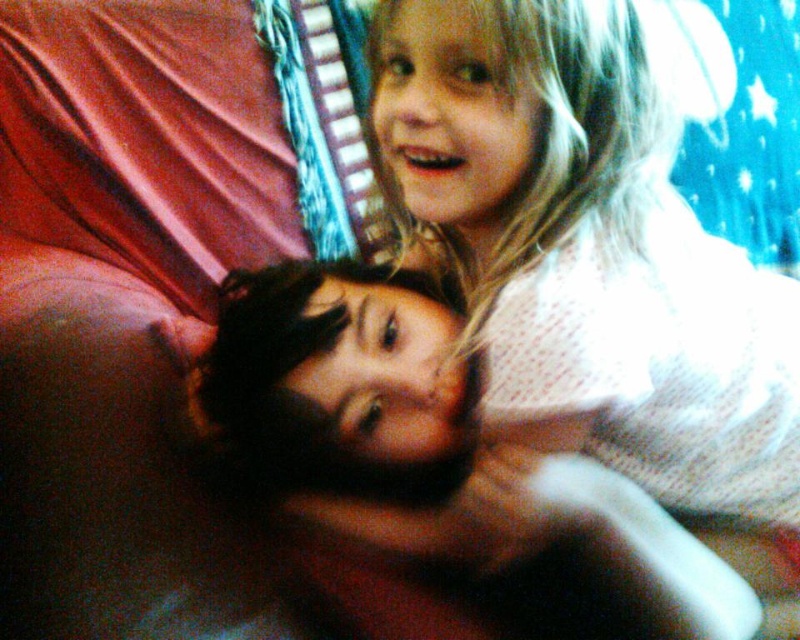
You are a photographer adjusting the camera focus. You notice the white dotted shirt at upper center and the smooth skin face at center. Which object should you focus on to ensure it appears sharp in the photo if you want the larger one in the frame?

The white dotted shirt at upper center is larger in size than the smooth skin face at center, so you should focus on the white dotted shirt at upper center to ensure it appears sharp in the photo.

You are a photographer trying to capture a close shot of the white dotted shirt at upper center. The camera you are using has a minimum focusing distance of 24 inches. Can you take the photo without moving the camera closer?

The distance between the white dotted shirt at upper center and the camera is 23.57 inches, which is less than the minimum focusing distance of 24 inches. Therefore, the camera cannot focus on the white dotted shirt at upper center without moving it further away.